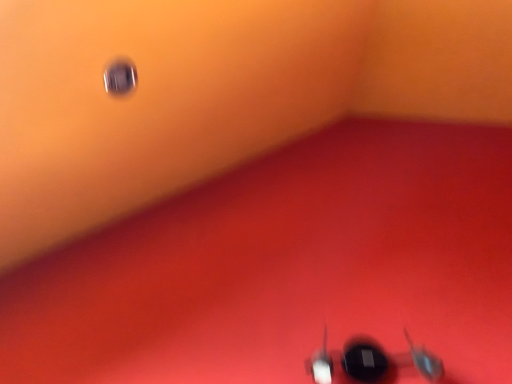
What is the approximate width of black matte headphones at bottom right?

black matte headphones at bottom right is 4.75 inches in width.

Describe the element at coordinates (387, 360) in the screenshot. I see `black matte headphones at bottom right` at that location.

Locate an element on the screen. This screenshot has height=384, width=512. black matte headphones at bottom right is located at coordinates (387, 360).

What are the coordinates of `black matte headphones at bottom right` in the screenshot? It's located at (387, 360).